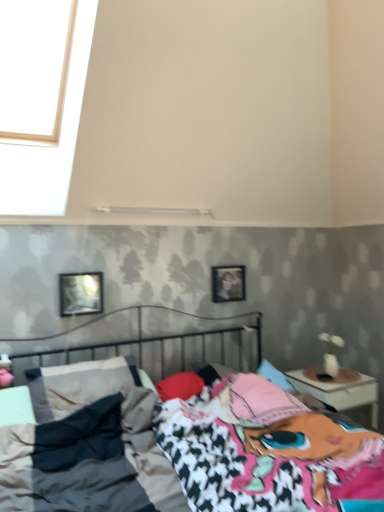
Question: Should I look upward or downward to see metallic reflective picture frame at upper left, the 2th picture frame viewed from the back?

Choices:
 (A) up
 (B) down

Answer: (B)

Question: Is the position of wooden frame at center, arranged as the 1th picture frame when viewed from the right, more distant than that of metallic reflective picture frame at upper left, marked as the 1th picture frame in a front-to-back arrangement?

Choices:
 (A) no
 (B) yes

Answer: (B)

Question: Is wooden frame at center, arranged as the 1th picture frame when viewed from the right, thinner than metallic reflective picture frame at upper left, the 2th picture frame viewed from the back?

Choices:
 (A) no
 (B) yes

Answer: (B)

Question: Does wooden frame at center, marked as the second picture frame in a left-to-right arrangement, appear on the left side of metallic reflective picture frame at upper left, the 2th picture frame viewed from the back?

Choices:
 (A) yes
 (B) no

Answer: (B)

Question: Is metallic reflective picture frame at upper left, the second picture frame from the right, completely or partially inside wooden frame at center, marked as the second picture frame in a left-to-right arrangement?

Choices:
 (A) yes
 (B) no

Answer: (B)

Question: Can you confirm if wooden frame at center, arranged as the 1th picture frame when viewed from the right, is shorter than metallic reflective picture frame at upper left, the 2th picture frame viewed from the back?

Choices:
 (A) no
 (B) yes

Answer: (A)

Question: Could you tell me if wooden frame at center, placed as the first picture frame when sorted from back to front, is turned towards metallic reflective picture frame at upper left, the second picture frame from the right?

Choices:
 (A) yes
 (B) no

Answer: (B)

Question: Considering the relative positions of white glossy nightstand at right and wooden frame at center, which ranks as the second picture frame in front-to-back order, in the image provided, is white glossy nightstand at right behind wooden frame at center, which ranks as the second picture frame in front-to-back order,?

Choices:
 (A) no
 (B) yes

Answer: (A)

Question: Is white glossy nightstand at right bigger than wooden frame at center, placed as the first picture frame when sorted from back to front?

Choices:
 (A) yes
 (B) no

Answer: (A)

Question: From a real-world perspective, is white glossy nightstand at right physically below wooden frame at center, arranged as the 1th picture frame when viewed from the right?

Choices:
 (A) no
 (B) yes

Answer: (B)

Question: From the image's perspective, is white glossy nightstand at right on wooden frame at center, which ranks as the second picture frame in front-to-back order?

Choices:
 (A) yes
 (B) no

Answer: (B)

Question: Is white glossy nightstand at right looking in the opposite direction of wooden frame at center, marked as the second picture frame in a left-to-right arrangement?

Choices:
 (A) yes
 (B) no

Answer: (B)

Question: Considering the relative sizes of white glossy nightstand at right and wooden frame at center, arranged as the 1th picture frame when viewed from the right, in the image provided, is white glossy nightstand at right wider than wooden frame at center, arranged as the 1th picture frame when viewed from the right,?

Choices:
 (A) yes
 (B) no

Answer: (A)

Question: Considering the relative sizes of metallic reflective picture frame at upper left, the second picture frame from the right, and metallic bed at center in the image provided, is metallic reflective picture frame at upper left, the second picture frame from the right, thinner than metallic bed at center?

Choices:
 (A) yes
 (B) no

Answer: (A)